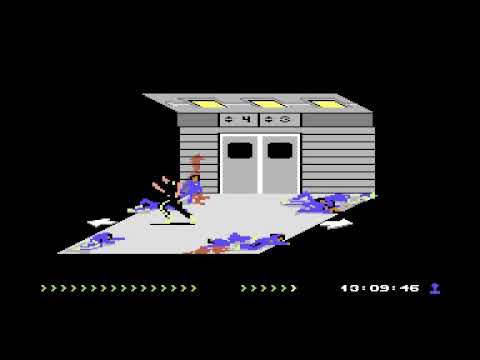
Find the location of `light`. light is located at coordinates (207, 99), (262, 100), (342, 103).